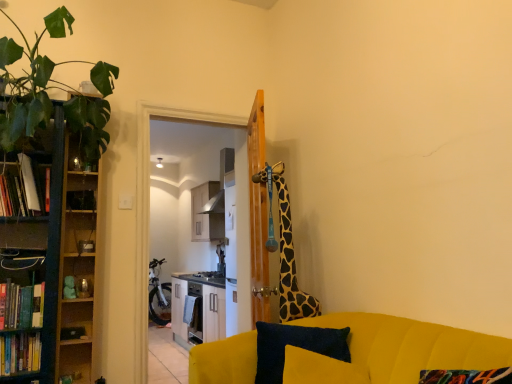
Question: From the image's perspective, is wooden shelf at left located above or below hardcover book at left, the second book positioned from the bottom?

Choices:
 (A) below
 (B) above

Answer: (B)

Question: Is wooden shelf at left to the left or to the right of hardcover book at left, the 2th book positioned from the top, in the image?

Choices:
 (A) right
 (B) left

Answer: (A)

Question: Estimate the real-world distances between objects in this image. Which object is closer to the white glossy cabinet at center?

Choices:
 (A) wooden shelf at left
 (B) wooden door at upper center
 (C) spotted fabric giraffe at upper right
 (D) hardcover book at left, the second book positioned from the bottom
 (E) white paper book at left, acting as the 1th book starting from the top

Answer: (B)

Question: Which object is positioned closest to the white glossy cabinet at center?

Choices:
 (A) velvet yellow couch at lower right
 (B) wooden door at upper center
 (C) spotted fabric giraffe at upper right
 (D) velvet dark blue pillow at lower center
 (E) hardcover book at left, acting as the 1th book starting from the bottom

Answer: (B)